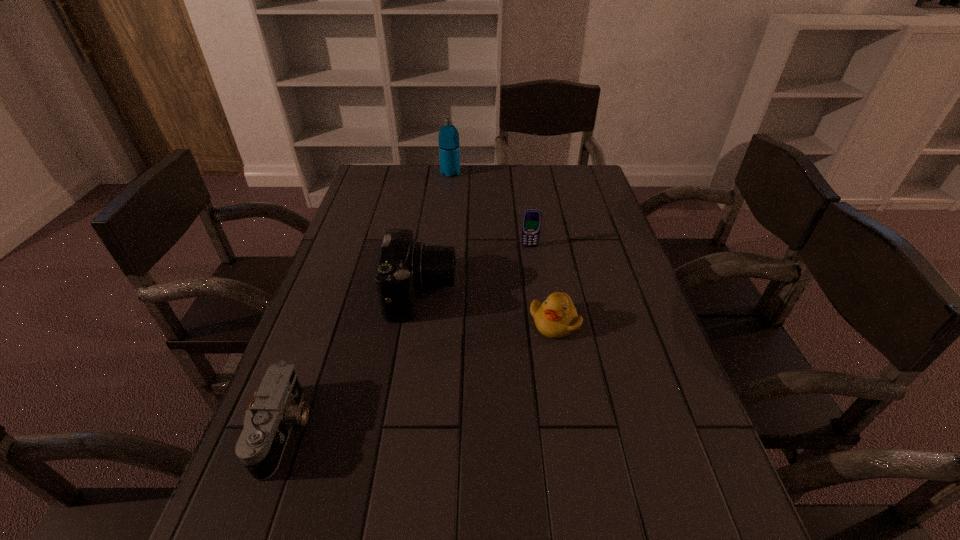
Identify the location of the farthest object. (449, 147).

Locate an element on the screen. the tallest object is located at coordinates (449, 147).

You are a GUI agent. You are given a task and a screenshot of the screen. Output one action in this format:
    pyautogui.click(x=<x>, y=<y>)
    Task: Click on the farther camera
    
    Given the screenshot: What is the action you would take?
    pyautogui.click(x=404, y=266)

Identify the location of the right camera. (404, 266).

Identify the location of the second farthest object. (531, 222).

I want to click on cellular telephone, so click(531, 222).

At what (x,y) coordinates should I click in order to perform the action: click on duckling. Please return your answer as a coordinate pair (x, y). Looking at the image, I should click on (556, 317).

You are a GUI agent. You are given a task and a screenshot of the screen. Output one action in this format:
    pyautogui.click(x=<x>, y=<y>)
    Task: Click on the leftmost object
    This screenshot has width=960, height=540.
    Given the screenshot: What is the action you would take?
    pyautogui.click(x=267, y=425)

Where is `the nearest object`? Image resolution: width=960 pixels, height=540 pixels. the nearest object is located at coordinates (267, 425).

Where is `vacant area situated 0.240m on the front of the tallest object`? vacant area situated 0.240m on the front of the tallest object is located at coordinates (446, 214).